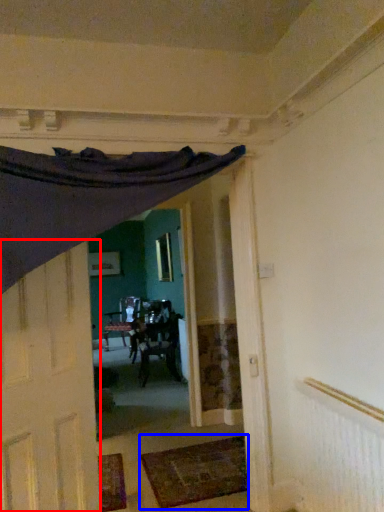
Question: Which of the following is the closest to the observer, door (highlighted by a red box) or mat (highlighted by a blue box)?

Choices:
 (A) door
 (B) mat

Answer: (A)